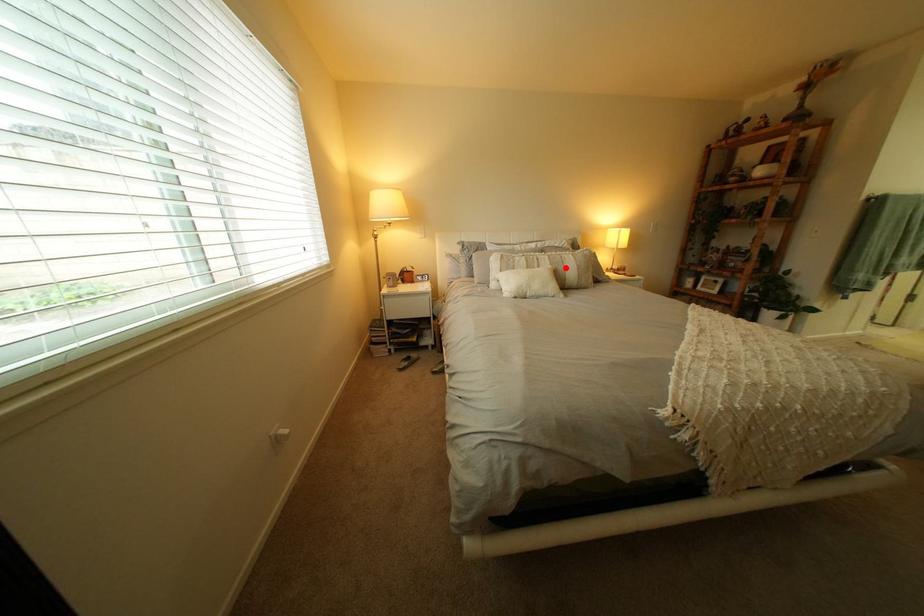
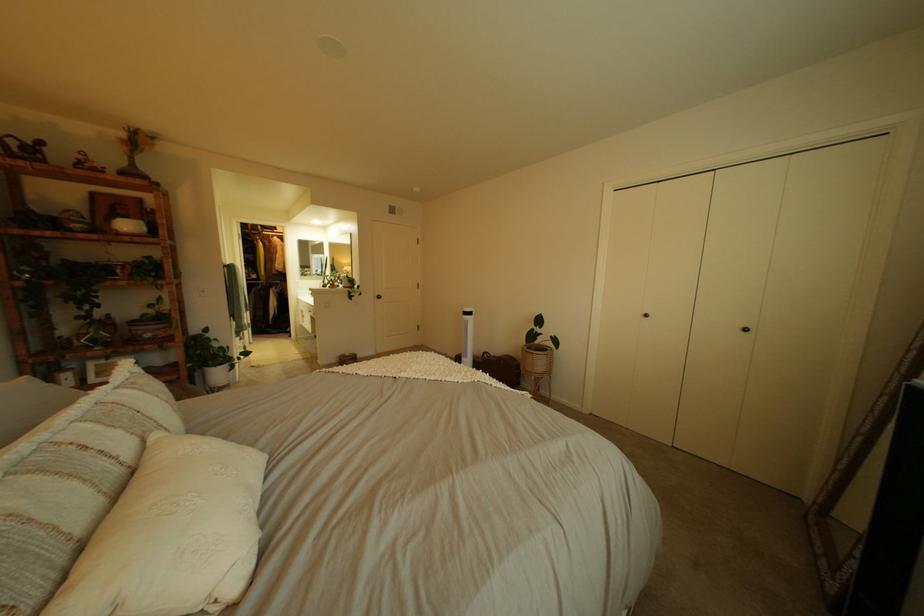
Find the pixel in the second image that matches the highlighted location in the first image.

(172, 436)